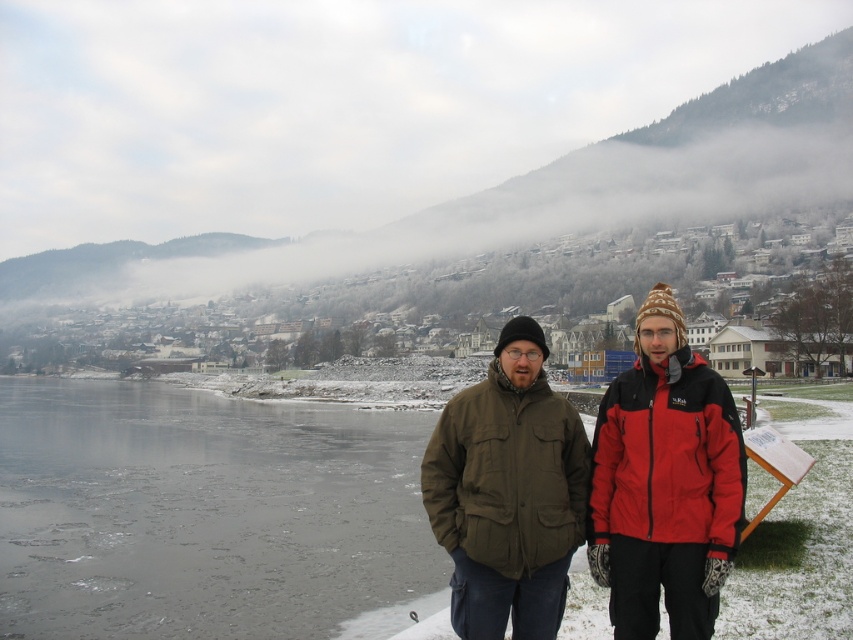
Question: Estimate the real-world distances between objects in this image. Which object is farther from the matte green jacket at center?

Choices:
 (A) red fleece jacket at center
 (B) olive green fabric jacket at center

Answer: (B)

Question: Is frozen ice at lower left smaller than red fleece jacket at center?

Choices:
 (A) yes
 (B) no

Answer: (B)

Question: Is red fleece jacket at center further to camera compared to olive green fabric jacket at center?

Choices:
 (A) yes
 (B) no

Answer: (B)

Question: Which point is closer to the camera taking this photo?

Choices:
 (A) (466, 605)
 (B) (698, 625)

Answer: (B)

Question: Does frozen ice at lower left appear on the right side of olive green fabric jacket at center?

Choices:
 (A) yes
 (B) no

Answer: (B)

Question: Which of the following is the closest to the observer?

Choices:
 (A) red fleece jacket at center
 (B) frozen ice at lower left

Answer: (A)